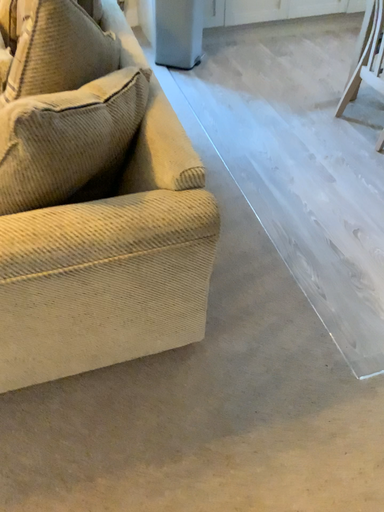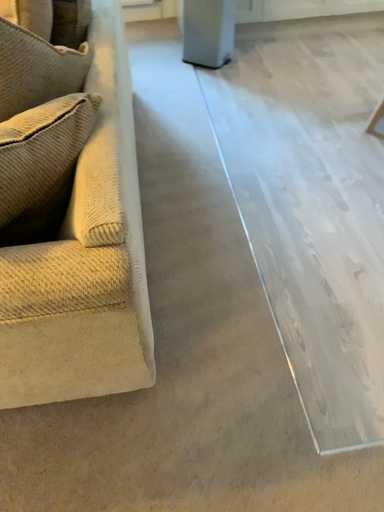
Question: How did the camera likely rotate when shooting the video?

Choices:
 (A) rotated right
 (B) rotated left

Answer: (B)